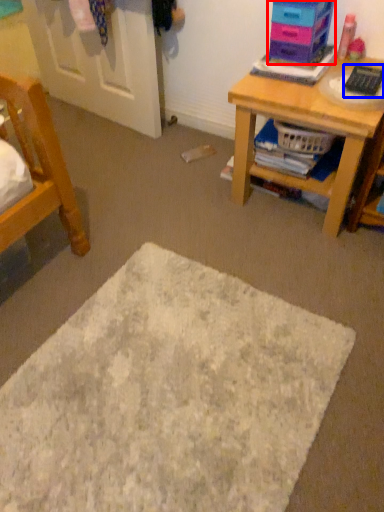
Question: Which object is further to the camera taking this photo, shelf (highlighted by a red box) or remote control (highlighted by a blue box)?

Choices:
 (A) shelf
 (B) remote control

Answer: (A)